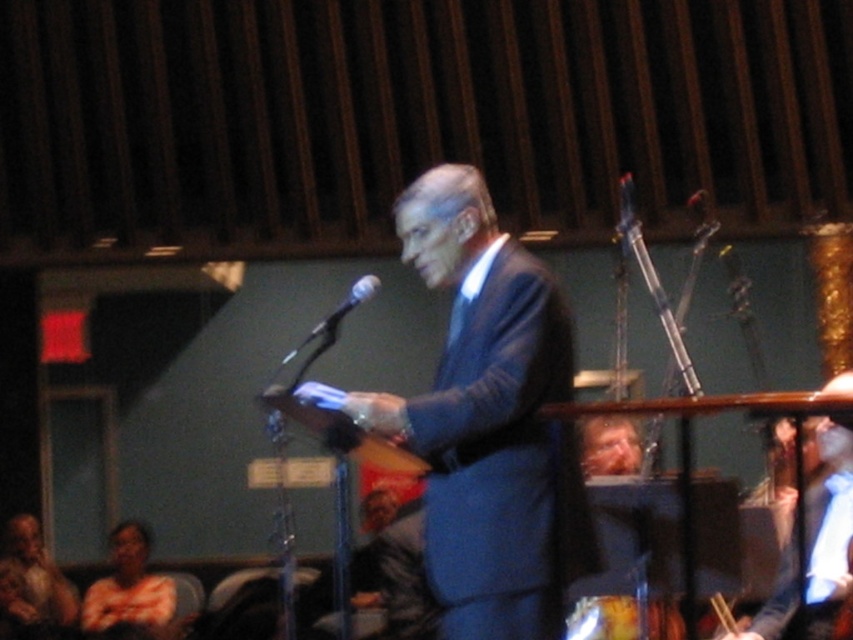
Does blue suit at center appear on the left side of orange t-shirt at lower left?

No, blue suit at center is not to the left of orange t-shirt at lower left.

Which is behind, point (526, 376) or point (143, 576)?

The point (143, 576) is behind.

Is point (456, 368) in front of point (108, 634)?

Yes, it is.

Where is `blue suit at center`? blue suit at center is located at coordinates (489, 420).

The width and height of the screenshot is (853, 640). Describe the element at coordinates (815, 547) in the screenshot. I see `blue fabric shirt at right` at that location.

Is point (828, 536) behind point (138, 525)?

No, it is in front of (138, 525).

You are a GUI agent. You are given a task and a screenshot of the screen. Output one action in this format:
    pyautogui.click(x=<x>, y=<y>)
    Task: Click on the blue fabric shirt at right
    This screenshot has height=640, width=853.
    Given the screenshot: What is the action you would take?
    pyautogui.click(x=815, y=547)

Does point (85, 609) come closer to viewer compared to point (346, 304)?

No, it is behind (346, 304).

Does point (149, 580) come behind point (357, 280)?

No.

Image resolution: width=853 pixels, height=640 pixels. I want to click on orange t-shirt at lower left, so click(129, 592).